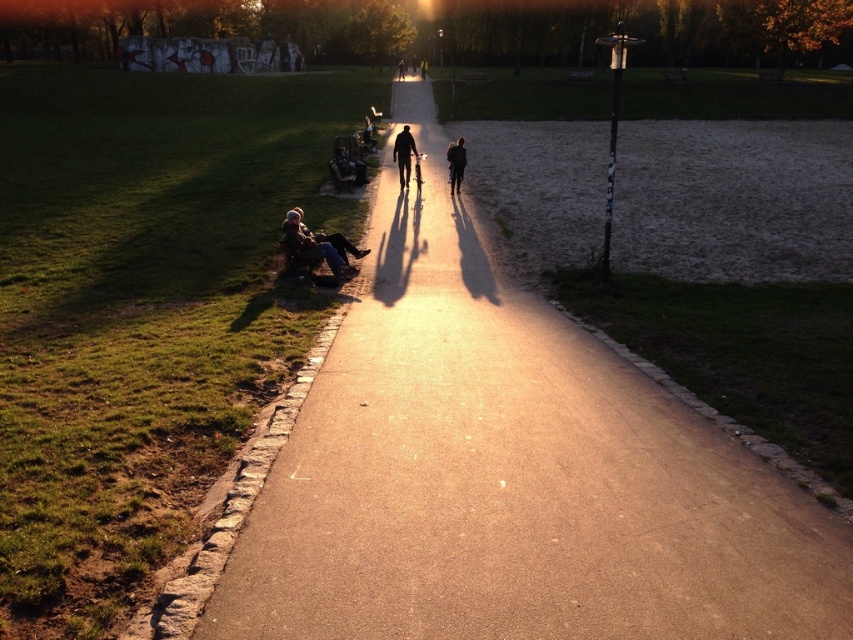
You are standing at the center of the park path and see the dark brown leather jacket at lower left. Based on its coordinates, where exactly is the jacket located relative to the path?

The dark brown leather jacket at lower left is located at coordinates point (309, 244), which places it on the left side of the path near the lower section.

You are standing at the point marked by the coordinates point (403, 154) in the park scene. Looking around, you notice dark blue jeans at center. Which direction should you walk to reach the paved pathway that stretches into the distance?

The paved pathway is located to the right of the dark blue jeans at center, so you should walk towards the right to reach it.